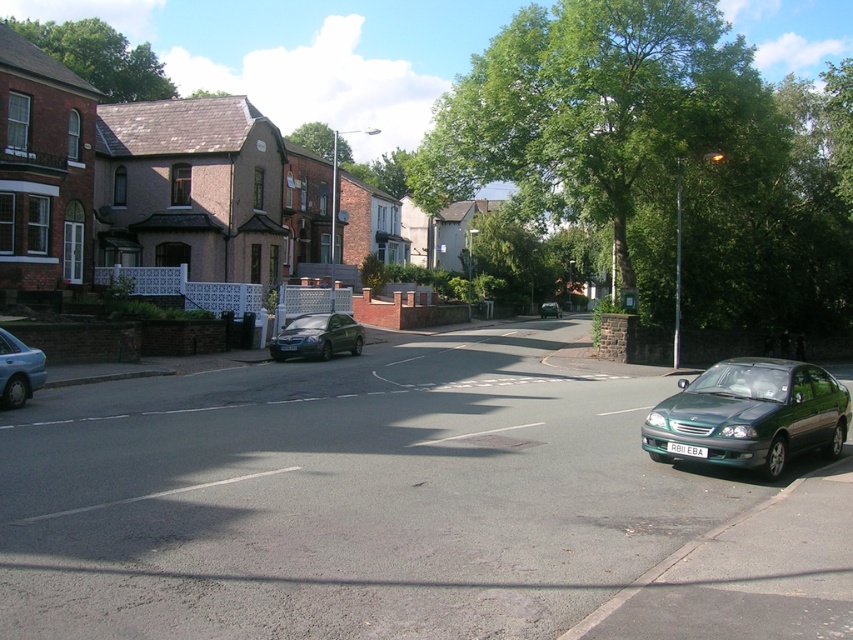
You are a pedestrian standing at the intersection and want to cross the street. There is a green leafy tree at upper center and a metallic silver sedan at left. Which object is closer to your left side as you face the intersection?

The metallic silver sedan at left is closer to your left side as you face the intersection because it is positioned to the left of the green leafy tree at upper center.

You are a pedestrian standing at the intersection and want to cross the road. The green metallic car at lower right and the metallic silver sedan at left are parked on opposite sides of the road. If you need to walk between them to cross, will there be enough space? Please consider the standard width of a pedestrian path is 2 meters.

The distance between the green metallic car at lower right and the metallic silver sedan at left is 11.51 meters. Since the required space for a pedestrian path is 2 meters, there is more than enough space to safely cross between them.